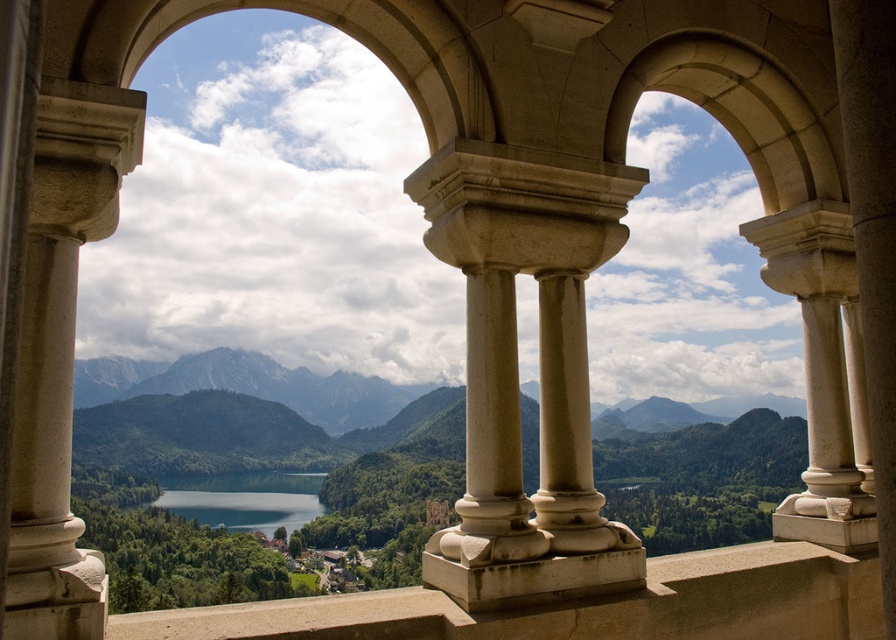
You are standing inside the stone structure and want to take a photo of the shiny blue water at center without the smooth stone column at left blocking the view. Which direction should you move to ensure the column is out of frame?

You should move to the left side of the shiny blue water at center so that the smooth stone column at left is no longer blocking the view.

You are standing at the center of the stone structure. Which direction should you walk to reach the smooth stone column at left?

You should walk to the left to reach the smooth stone column at left since it is located at the left side of the structure.

You are an architect designing a new structure that needs to incorporate both beige stone pillars and a reflective water feature. Based on the image provided, which object has a smaller width between the beige stone pillars at center and the shiny blue water at center?

The beige stone pillars at center has a lesser width compared to shiny blue water at center, so the beige stone pillars at center is the one with smaller width.